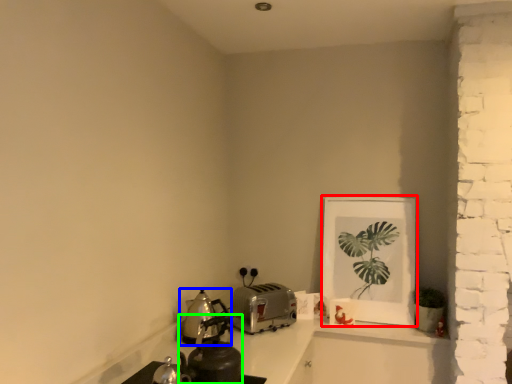
Question: Which object is the farthest from picture frame (highlighted by a red box)? Choose among these: kitchen appliance (highlighted by a blue box) or tea pot (highlighted by a green box).

Choices:
 (A) kitchen appliance
 (B) tea pot

Answer: (B)